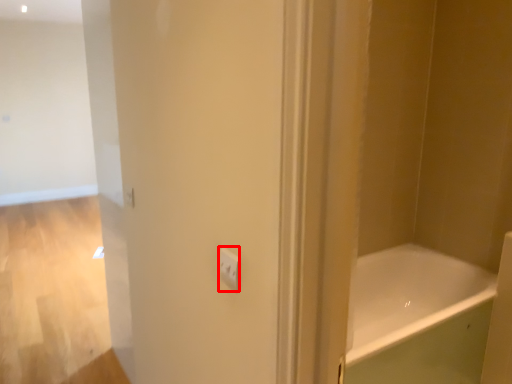
Question: Considering the relative positions of light switch (annotated by the red box) and bathtub in the image provided, where is light switch (annotated by the red box) located with respect to the staircase?

Choices:
 (A) left
 (B) right

Answer: (A)